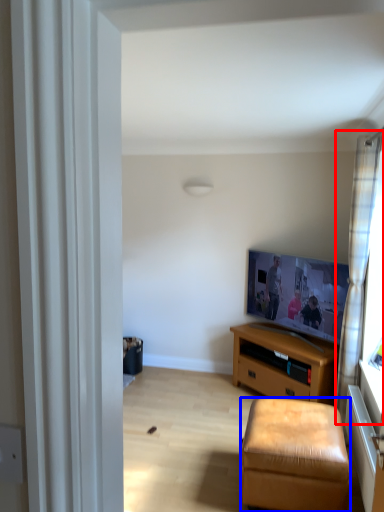
Question: Which of the following is the closest to the observer, curtain (highlighted by a red box) or stool (highlighted by a blue box)?

Choices:
 (A) curtain
 (B) stool

Answer: (B)